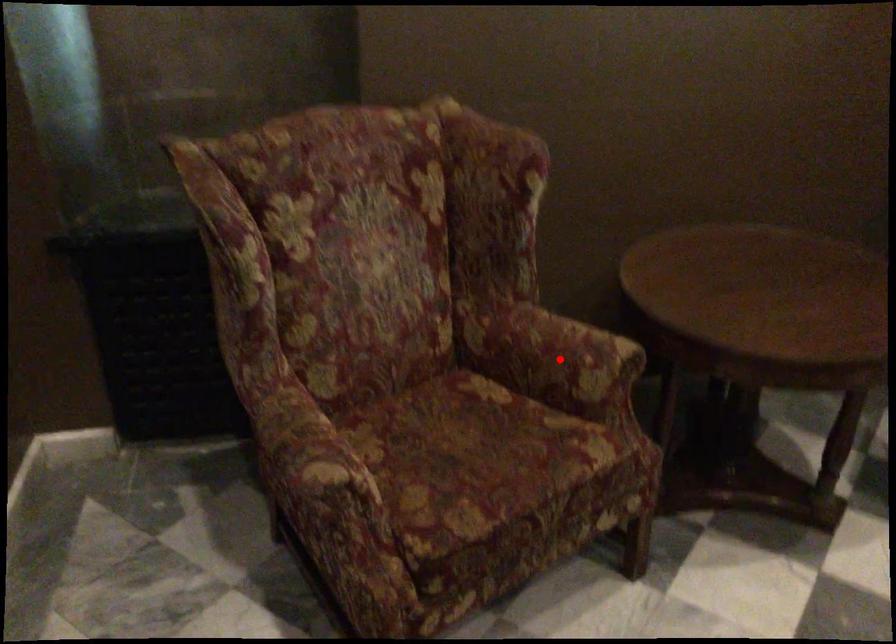
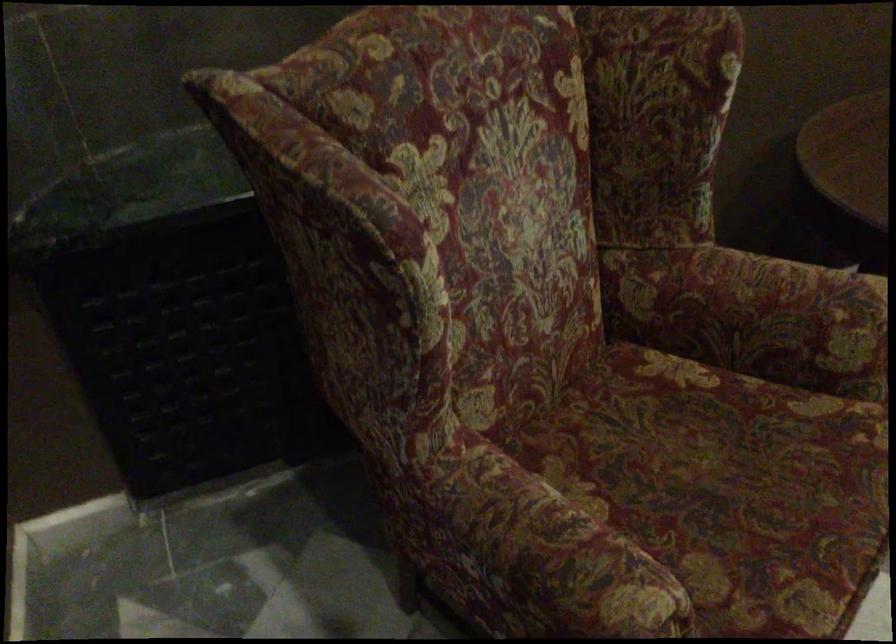
Find the pixel in the second image that matches the highlighted location in the first image.

(786, 321)